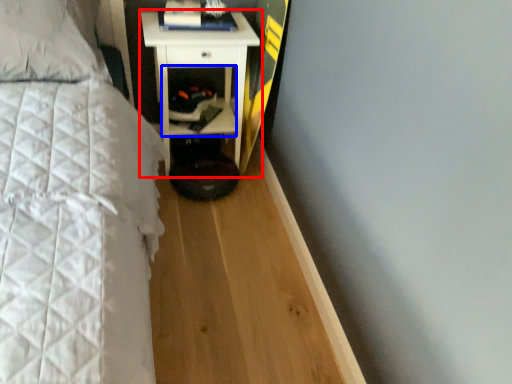
Question: Which object appears closest to the camera in this image, nightstand (highlighted by a red box) or cabinet (highlighted by a blue box)?

Choices:
 (A) nightstand
 (B) cabinet

Answer: (A)